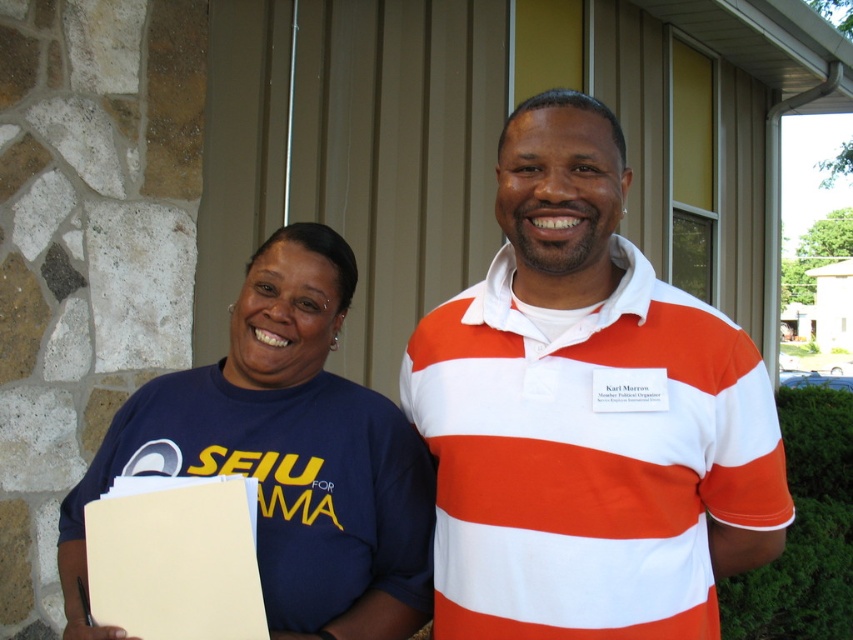
Can you confirm if white striped polo shirt at center is bigger than blue t-shirt at left?

Yes.

Between white striped polo shirt at center and blue t-shirt at left, which one is positioned higher?

Positioned higher is white striped polo shirt at center.

Find the location of a particular element. This screenshot has width=853, height=640. white striped polo shirt at center is located at coordinates (587, 413).

Where is `white striped polo shirt at center`? The image size is (853, 640). white striped polo shirt at center is located at coordinates (587, 413).